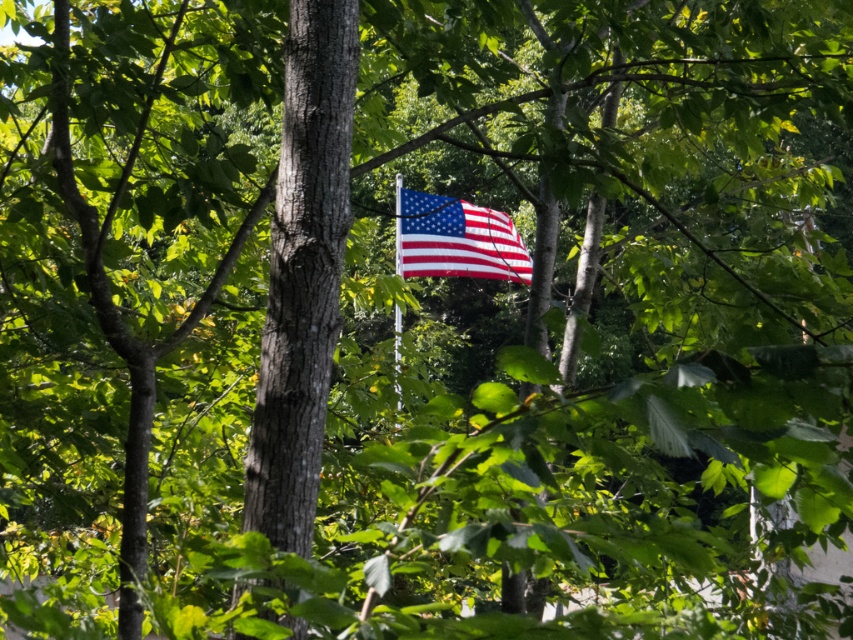
Question: Can you confirm if polished cotton flag at center is smaller than metallic silver flag pole at center?

Choices:
 (A) no
 (B) yes

Answer: (B)

Question: Can you confirm if polished cotton flag at center is positioned to the right of metallic silver flag pole at center?

Choices:
 (A) yes
 (B) no

Answer: (A)

Question: Can you confirm if polished cotton flag at center is wider than metallic silver flag pole at center?

Choices:
 (A) yes
 (B) no

Answer: (A)

Question: Which of the following is the closest to the observer?

Choices:
 (A) polished cotton flag at center
 (B) metallic silver flag pole at center

Answer: (B)